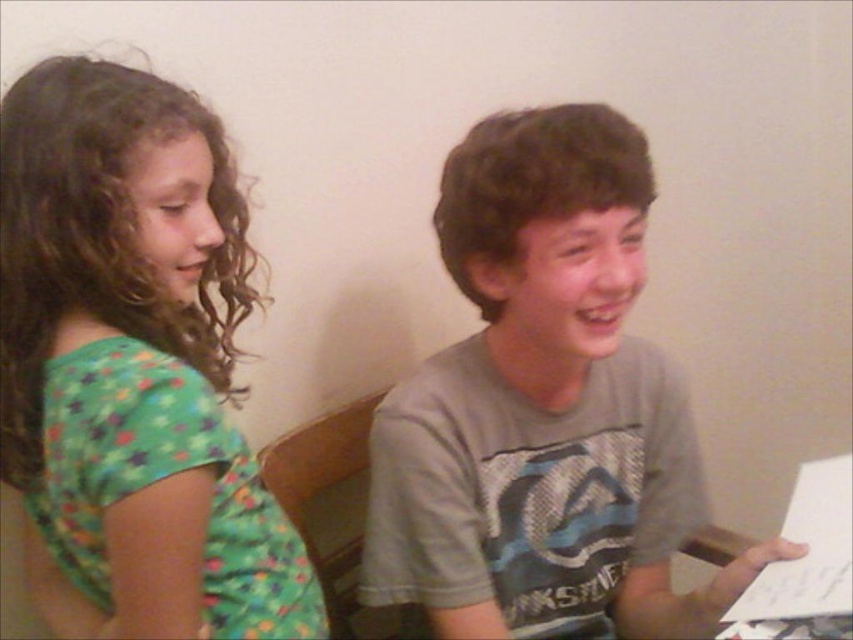
You are a photographer standing at the camera position. You want to take a photo of the two children sitting against the wall. There is a point at coordinates point (49, 323) that is 30.51 inches away from you. Is this point closer to you than the children?

The point at coordinates point (49, 323) is 30.51 inches away from the camera. Since the children are sitting against the wall, which is presumably farther away than the point, the point is closer to the photographer than the children.